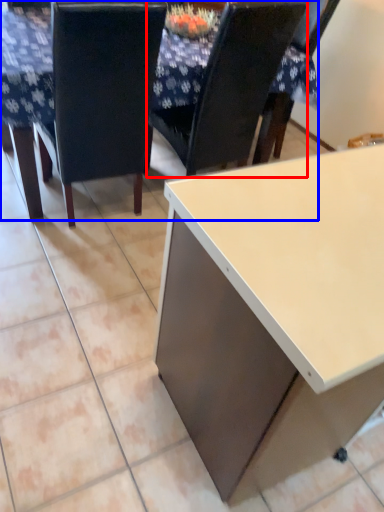
Question: Which of the following is the farthest to the observer, chair (highlighted by a red box) or table (highlighted by a blue box)?

Choices:
 (A) chair
 (B) table

Answer: (A)